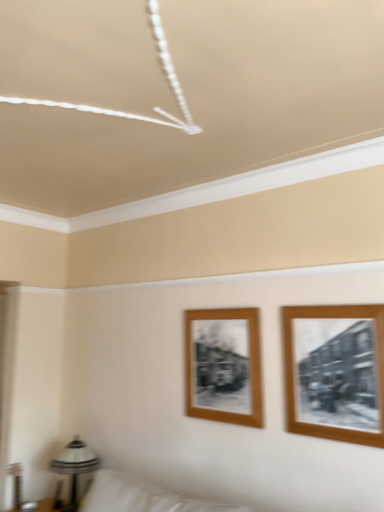
Question: Considering the relative sizes of metallic silver table lamp at lower left and wooden framed photo at right, the 2th picture frame from the back, in the image provided, is metallic silver table lamp at lower left thinner than wooden framed photo at right, the 2th picture frame from the back,?

Choices:
 (A) no
 (B) yes

Answer: (A)

Question: Does metallic silver table lamp at lower left have a larger size compared to wooden framed photo at right, the 2th picture frame from the back?

Choices:
 (A) no
 (B) yes

Answer: (B)

Question: From a real-world perspective, is metallic silver table lamp at lower left located beneath wooden framed photo at right, positioned as the first picture frame in right-to-left order?

Choices:
 (A) yes
 (B) no

Answer: (A)

Question: Would you say metallic silver table lamp at lower left is a long distance from wooden framed photo at right, positioned as the first picture frame in right-to-left order?

Choices:
 (A) no
 (B) yes

Answer: (B)

Question: Does metallic silver table lamp at lower left lie in front of wooden framed photo at right, positioned as the first picture frame in right-to-left order?

Choices:
 (A) no
 (B) yes

Answer: (A)

Question: Is metallic silver table lamp at lower left next to wooden framed photo at right, which is the first picture frame from front to back?

Choices:
 (A) no
 (B) yes

Answer: (A)

Question: From a real-world perspective, is wooden frame at center, which ranks as the 1th picture frame in left-to-right order, physically below wooden framed photo at right, which is the first picture frame from front to back?

Choices:
 (A) yes
 (B) no

Answer: (A)

Question: Is wooden frame at center, which is counted as the first picture frame, starting from the back, directly adjacent to wooden framed photo at right, the 2th picture frame from the back?

Choices:
 (A) no
 (B) yes

Answer: (A)

Question: Is the depth of wooden frame at center, marked as the 2th picture frame in a right-to-left arrangement, greater than that of wooden framed photo at right, positioned as the first picture frame in right-to-left order?

Choices:
 (A) yes
 (B) no

Answer: (A)

Question: Does wooden frame at center, which ranks as the 1th picture frame in left-to-right order, turn towards wooden framed photo at right, which is counted as the second picture frame, starting from the left?

Choices:
 (A) no
 (B) yes

Answer: (A)

Question: Are wooden frame at center, positioned as the 2th picture frame in front-to-back order, and wooden framed photo at right, which is counted as the second picture frame, starting from the left, located far from each other?

Choices:
 (A) no
 (B) yes

Answer: (A)

Question: Does wooden frame at center, which is counted as the first picture frame, starting from the back, appear on the right side of wooden framed photo at right, which is counted as the second picture frame, starting from the left?

Choices:
 (A) no
 (B) yes

Answer: (A)

Question: Is there a large distance between wooden framed photo at right, which is the first picture frame from front to back, and wooden frame at center, marked as the 2th picture frame in a right-to-left arrangement?

Choices:
 (A) yes
 (B) no

Answer: (B)